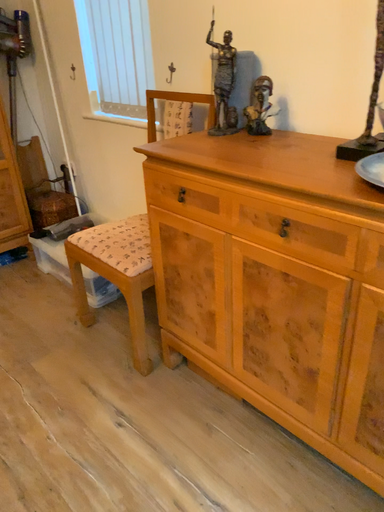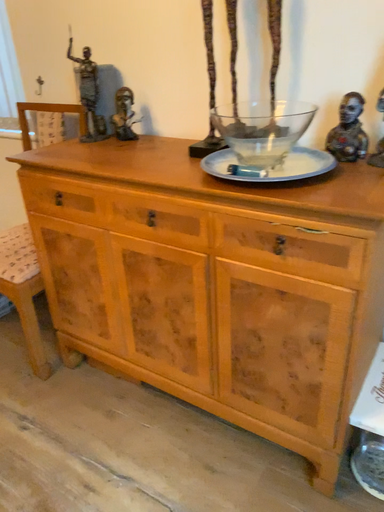
Question: Which way did the camera rotate in the video?

Choices:
 (A) rotated right
 (B) rotated left

Answer: (A)